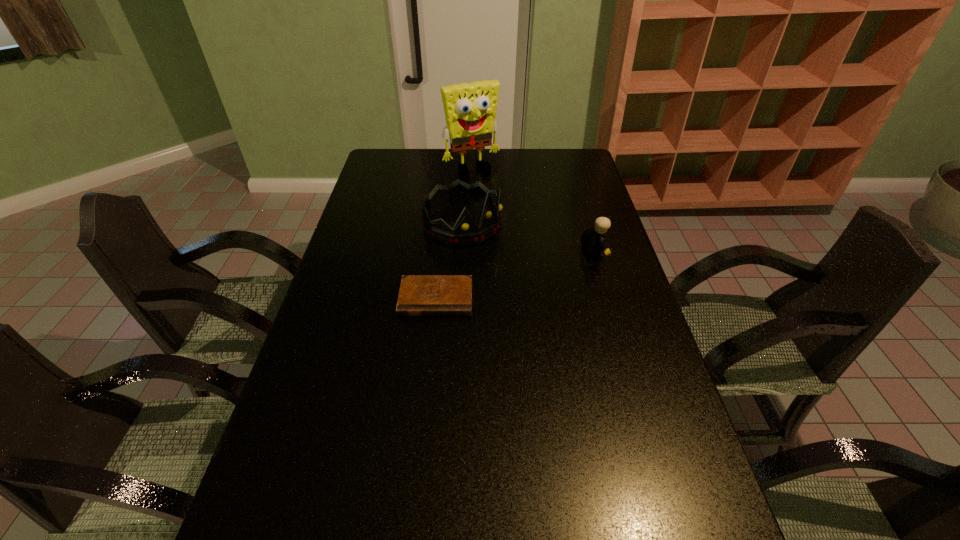
Find the location of a particular element. free spot on the desktop that is between the diary and the Lego and is positioned on the face of the tallest object is located at coordinates (541, 268).

I want to click on vacant space on the desktop that is between the shortest object and the third tallest object and is positioned at the front of the tiara with jewels, so click(x=534, y=270).